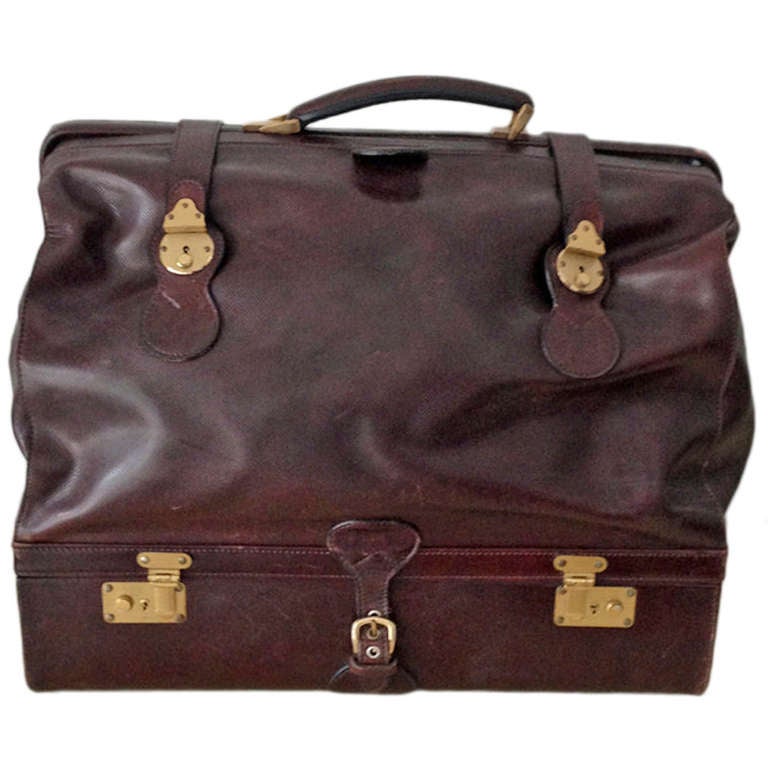
What are the coordinates of `lock` in the screenshot? It's located at (144, 611), (590, 614).